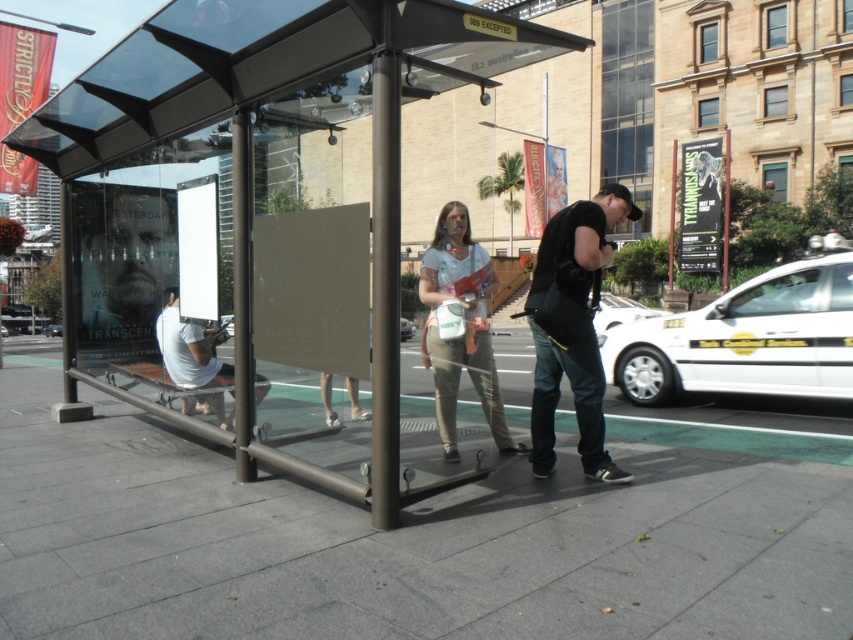
You are a pedestrian approaching the bus stop shelter. You see the transparent glass canopy at upper center and the light brown fabric pants at center. Which object is positioned to the left when viewed from the front of the shelter?

The transparent glass canopy at upper center is to the left of the light brown fabric pants at center when viewed from the front of the shelter.

In the scene shown: You are a delivery person who needs to place a large package inside the transparent glass bus stop at center. However, there is a black leather jacket at center already occupying space. Can you fit the package inside the bus stop without removing the jacket?

The transparent glass bus stop at center is larger in size than the black leather jacket at center, so there should be enough space to fit the package inside the bus stop without removing the jacket.

You are a pedestrian trying to take a photo of the transparent glass bus stop at center and the black leather jacket at center. Since both are at the center, which one will appear larger in your camera view?

The transparent glass bus stop at center will appear larger in your camera view because it is closer to the viewer than the black leather jacket at center.